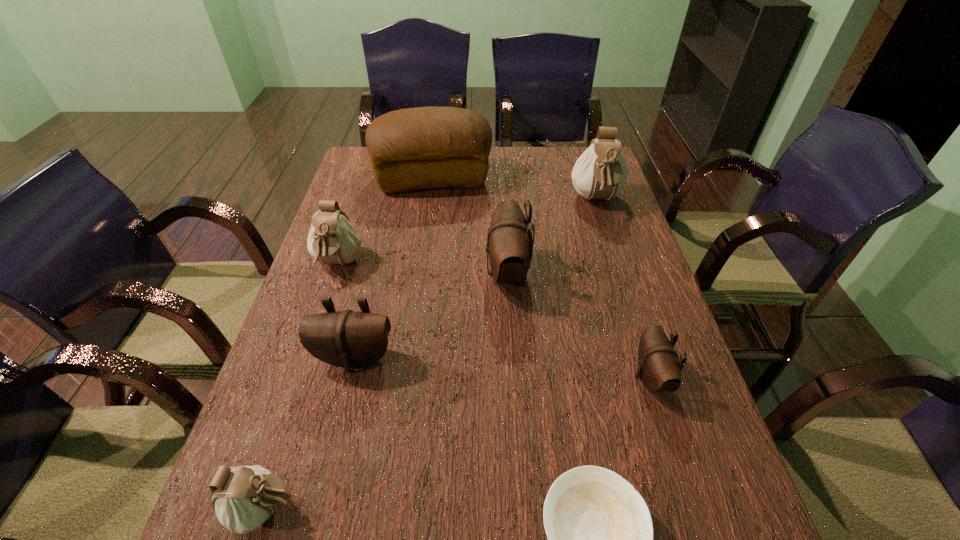
Where is `object at the far left corner`? This screenshot has height=540, width=960. object at the far left corner is located at coordinates (429, 147).

The width and height of the screenshot is (960, 540). I want to click on free location at the far edge of the desktop, so click(x=547, y=167).

Image resolution: width=960 pixels, height=540 pixels. In the image, there is a desktop. Find the location of `vacant space at the left edge`. vacant space at the left edge is located at coordinates (358, 265).

Locate an element on the screen. This screenshot has height=540, width=960. vacant space at the right edge of the desktop is located at coordinates (619, 212).

I want to click on vacant area between the smallest brown pouch and the second brown pouch from right to left, so click(x=579, y=325).

Identify the location of empty space between the bread and the third pouch from right to left. point(470,226).

Identify the location of vacant space that is in between the farthest pouch and the smallest brown pouch. Image resolution: width=960 pixels, height=540 pixels. (623, 289).

The height and width of the screenshot is (540, 960). What are the coordinates of `free space between the second biggest white pouch and the farthest brown pouch` in the screenshot? It's located at 422,268.

The height and width of the screenshot is (540, 960). I want to click on free space between the smallest brown pouch and the brown bread, so click(542, 278).

Identify the location of object that ranks as the seventh closest to the biggest brown pouch. (245, 496).